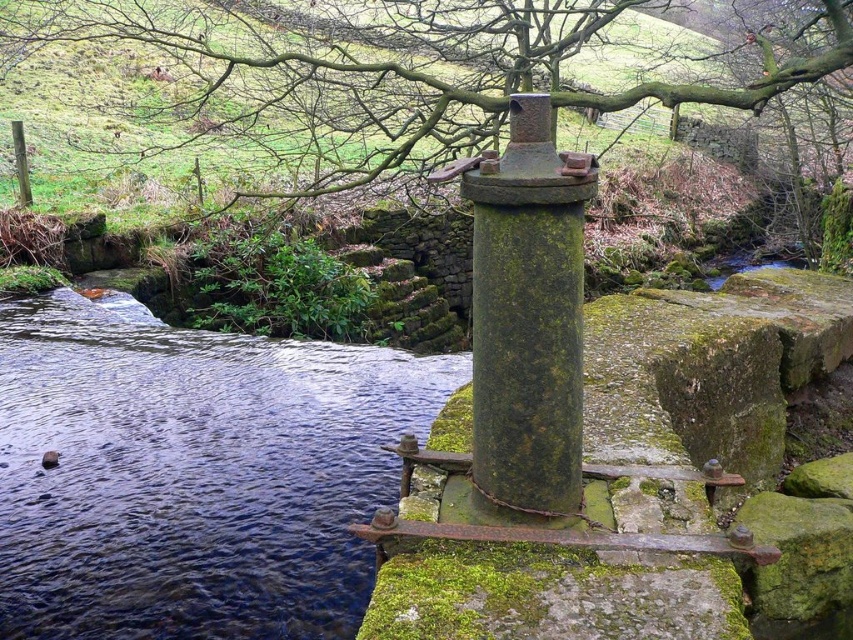
From the picture: You are standing at the center of the waterway in the image. You see a weathered metal structure on a stone platform and a point marked at coordinates (192, 474). Which direction should you walk to reach the green mossy stone indicated by the point?

The point at (192, 474) marks the green mossy stone at lower left, so you should walk towards the lower left direction to reach it.

You are a frog trying to jump from the green mossy stone at lower left to the green mossy stone at center. Considering their sizes, which stone will provide a more stable landing? Explain your reasoning.

The green mossy stone at lower left is larger than the green mossy stone at center. Since the larger stone has a bigger surface area, it will provide a more stable landing for the frog.